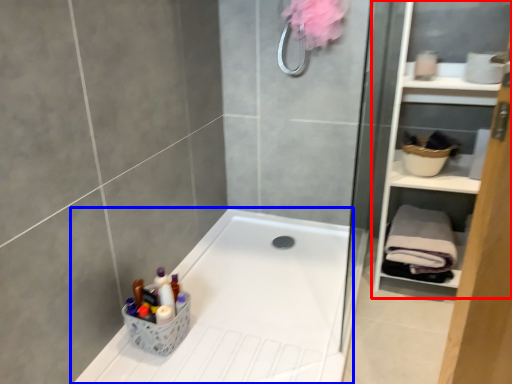
Question: Among these objects, which one is nearest to the camera, cabinet (highlighted by a red box) or bathtub (highlighted by a blue box)?

Choices:
 (A) cabinet
 (B) bathtub

Answer: (B)